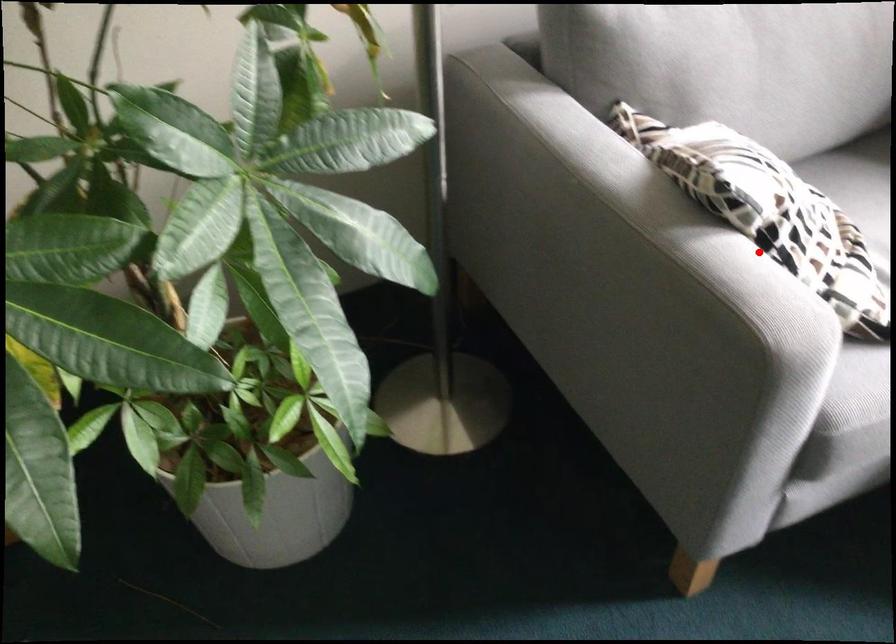
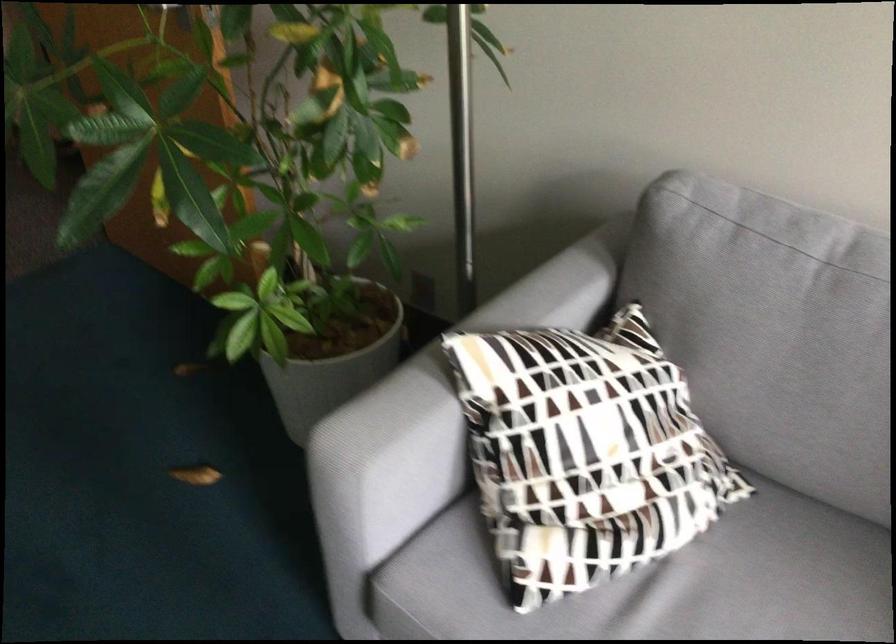
Question: I am providing you with two images of the same scene from different viewpoints. A red point is shown in image1. For the corresponding object point in image2, is it positioned nearer or farther from the camera?

Choices:
 (A) Nearer
 (B) Farther

Answer: (B)